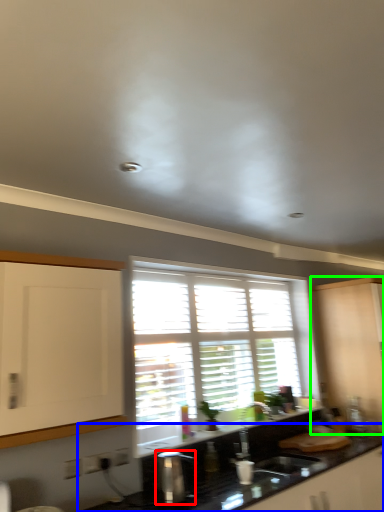
Question: Which object is positioned closest to appliance (highlighted by a red box)? Select from countertop (highlighted by a blue box) and cabinetry (highlighted by a green box).

Choices:
 (A) countertop
 (B) cabinetry

Answer: (A)